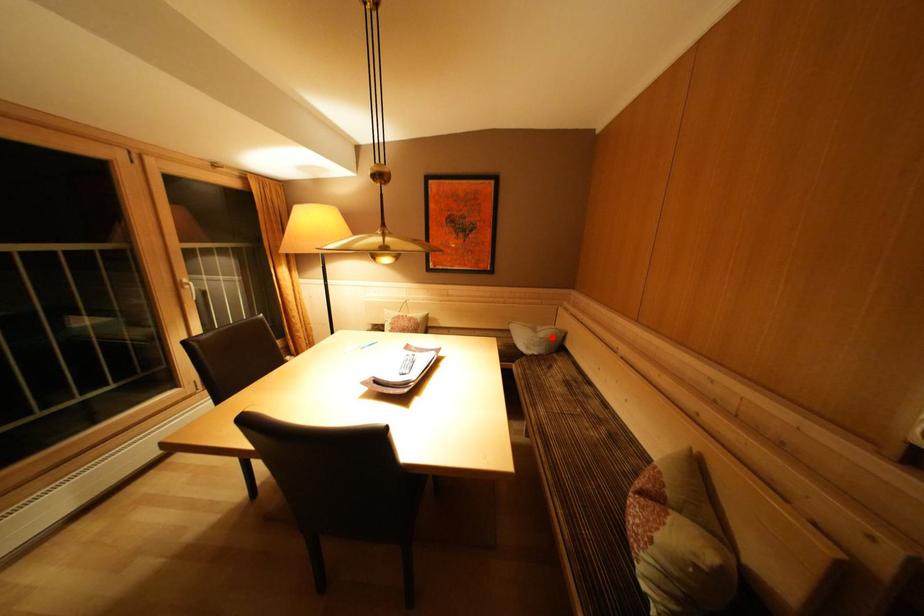
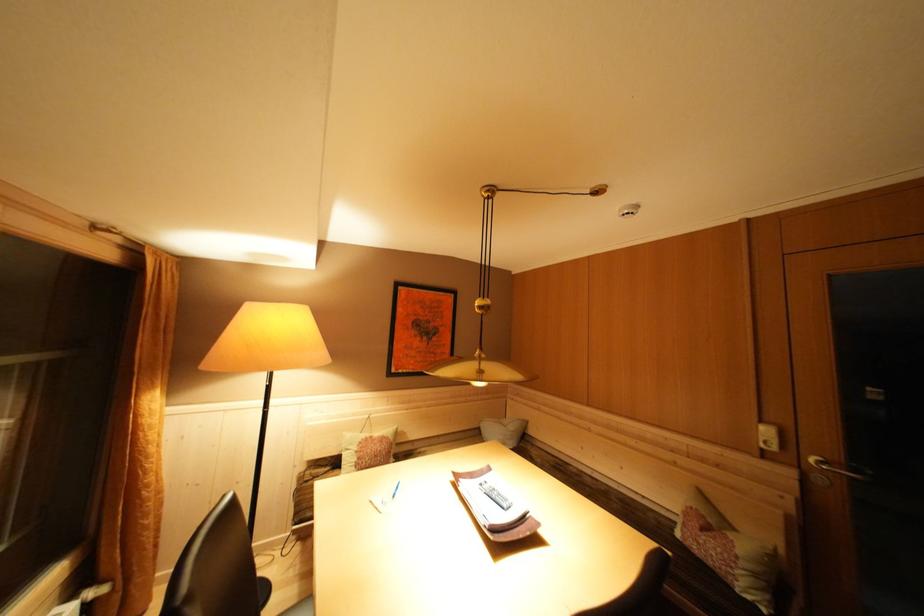
Question: I am providing you with two images of the same scene from different viewpoints. In image1, a red point is highlighted. Considering the same 3D point in image2, which of the following is correct?

Choices:
 (A) It is closer
 (B) It is farther

Answer: (B)